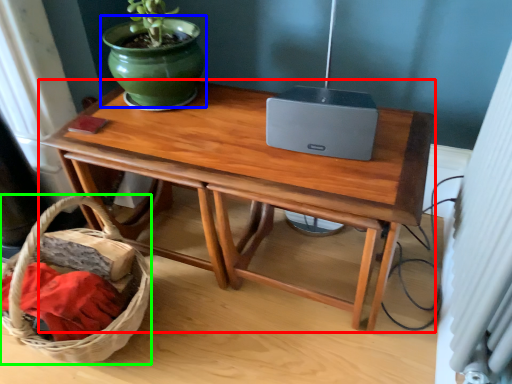
Question: Which object is the closest to the table (highlighted by a red box)? Choose among these: flowerpot (highlighted by a blue box) or basket (highlighted by a green box).

Choices:
 (A) flowerpot
 (B) basket

Answer: (A)